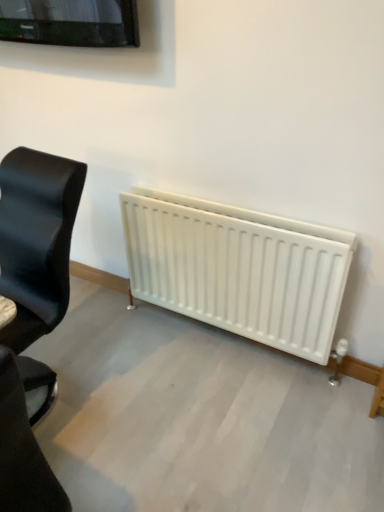
Find the location of a particular element. This screenshot has height=512, width=384. black leather chair at left, the 2th chair when ordered from front to back is located at coordinates (36, 240).

Measure the distance between point (72, 193) and camera.

The depth of point (72, 193) is 5.42 feet.

What do you see at coordinates (36, 240) in the screenshot? This screenshot has height=512, width=384. I see `black leather chair at left, the 2th chair when ordered from front to back` at bounding box center [36, 240].

This screenshot has height=512, width=384. What do you see at coordinates (23, 452) in the screenshot? I see `black leather chair at lower left, arranged as the second chair when viewed from the back` at bounding box center [23, 452].

Identify the location of black leather chair at lower left, arranged as the second chair when viewed from the back. (23, 452).

Where is `black leather chair at left, which is counted as the first chair, starting from the back`? black leather chair at left, which is counted as the first chair, starting from the back is located at coordinates (36, 240).

Is black leather chair at lower left, positioned as the first chair in front-to-back order, at the left side of black leather chair at left, the 2th chair when ordered from front to back?

Incorrect, black leather chair at lower left, positioned as the first chair in front-to-back order, is not on the left side of black leather chair at left, the 2th chair when ordered from front to back.

Consider the image. Is the position of black leather chair at lower left, positioned as the first chair in front-to-back order, more distant than that of black leather chair at left, the 2th chair when ordered from front to back?

No, the depth of black leather chair at lower left, positioned as the first chair in front-to-back order, is less than that of black leather chair at left, the 2th chair when ordered from front to back.

Is point (15, 474) in front of point (59, 209)?

That is True.

From the image's perspective, who appears lower, black leather chair at lower left, positioned as the first chair in front-to-back order, or black leather chair at left, which is counted as the first chair, starting from the back?

black leather chair at lower left, positioned as the first chair in front-to-back order, appears lower in the image.

Based on the photo, from a real-world perspective, who is located higher, black leather chair at lower left, positioned as the first chair in front-to-back order, or black leather chair at left, the 2th chair when ordered from front to back?

black leather chair at left, the 2th chair when ordered from front to back, from a real-world perspective.

Considering the relative sizes of black leather chair at lower left, arranged as the second chair when viewed from the back, and black leather chair at left, which is counted as the first chair, starting from the back, in the image provided, is black leather chair at lower left, arranged as the second chair when viewed from the back, wider than black leather chair at left, which is counted as the first chair, starting from the back,?

Yes.

Between black leather chair at lower left, positioned as the first chair in front-to-back order, and black leather chair at left, which is counted as the first chair, starting from the back, which one has less height?

With less height is black leather chair at left, which is counted as the first chair, starting from the back.

From the picture: In terms of size, does black leather chair at lower left, positioned as the first chair in front-to-back order, appear bigger or smaller than black leather chair at left, the 2th chair when ordered from front to back?

Clearly, black leather chair at lower left, positioned as the first chair in front-to-back order, is smaller in size than black leather chair at left, the 2th chair when ordered from front to back.

Is black leather chair at left, the 2th chair when ordered from front to back, a part of black leather chair at lower left, arranged as the second chair when viewed from the back?

No, black leather chair at left, the 2th chair when ordered from front to back, is not a part of black leather chair at lower left, arranged as the second chair when viewed from the back.

From the picture: Are black leather chair at lower left, arranged as the second chair when viewed from the back, and black leather chair at left, the 2th chair when ordered from front to back, beside each other?

No, black leather chair at lower left, arranged as the second chair when viewed from the back, is not next to black leather chair at left, the 2th chair when ordered from front to back.

Is black leather chair at lower left, arranged as the second chair when viewed from the back, facing towards black leather chair at left, the 2th chair when ordered from front to back?

No, black leather chair at lower left, arranged as the second chair when viewed from the back, does not turn towards black leather chair at left, the 2th chair when ordered from front to back.

What's the angular difference between black leather chair at lower left, positioned as the first chair in front-to-back order, and black leather chair at left, which is counted as the first chair, starting from the back,'s facing directions?

85.6 degrees separate the facing orientations of black leather chair at lower left, positioned as the first chair in front-to-back order, and black leather chair at left, which is counted as the first chair, starting from the back.

How far apart are black leather chair at lower left, positioned as the first chair in front-to-back order, and black leather chair at left, which is counted as the first chair, starting from the back?

A distance of 29.55 inches exists between black leather chair at lower left, positioned as the first chair in front-to-back order, and black leather chair at left, which is counted as the first chair, starting from the back.

Where is `chair behind the black leather chair at lower left, arranged as the second chair when viewed from the back`? This screenshot has width=384, height=512. chair behind the black leather chair at lower left, arranged as the second chair when viewed from the back is located at coordinates (36, 240).

Between black leather chair at left, the 2th chair when ordered from front to back, and black leather chair at lower left, positioned as the first chair in front-to-back order, which one appears on the right side from the viewer's perspective?

black leather chair at lower left, positioned as the first chair in front-to-back order.

Considering the positions of objects black leather chair at left, which is counted as the first chair, starting from the back, and black leather chair at lower left, positioned as the first chair in front-to-back order, in the image provided, who is behind, black leather chair at left, which is counted as the first chair, starting from the back, or black leather chair at lower left, positioned as the first chair in front-to-back order,?

black leather chair at left, which is counted as the first chair, starting from the back, is further away from the camera.

Which is closer to the camera, [13,346] or [17,474]?

The point [17,474] is more forward.

From the image's perspective, who appears lower, black leather chair at left, the 2th chair when ordered from front to back, or black leather chair at lower left, positioned as the first chair in front-to-back order?

From the image's view, black leather chair at lower left, positioned as the first chair in front-to-back order, is below.

From a real-world perspective, is black leather chair at left, which is counted as the first chair, starting from the back, positioned under black leather chair at lower left, positioned as the first chair in front-to-back order, based on gravity?

No.

Considering the relative sizes of black leather chair at left, the 2th chair when ordered from front to back, and black leather chair at lower left, arranged as the second chair when viewed from the back, in the image provided, is black leather chair at left, the 2th chair when ordered from front to back, wider than black leather chair at lower left, arranged as the second chair when viewed from the back,?

In fact, black leather chair at left, the 2th chair when ordered from front to back, might be narrower than black leather chair at lower left, arranged as the second chair when viewed from the back.

In the scene shown: Considering the sizes of objects black leather chair at left, which is counted as the first chair, starting from the back, and black leather chair at lower left, arranged as the second chair when viewed from the back, in the image provided, who is shorter, black leather chair at left, which is counted as the first chair, starting from the back, or black leather chair at lower left, arranged as the second chair when viewed from the back,?

With less height is black leather chair at left, which is counted as the first chair, starting from the back.

Who is bigger, black leather chair at left, the 2th chair when ordered from front to back, or black leather chair at lower left, positioned as the first chair in front-to-back order?

black leather chair at left, the 2th chair when ordered from front to back, is bigger.

Is black leather chair at left, the 2th chair when ordered from front to back, positioned beyond the bounds of black leather chair at lower left, positioned as the first chair in front-to-back order?

black leather chair at left, the 2th chair when ordered from front to back, is positioned outside black leather chair at lower left, positioned as the first chair in front-to-back order.

Are black leather chair at left, the 2th chair when ordered from front to back, and black leather chair at lower left, positioned as the first chair in front-to-back order, located far from each other?

No, black leather chair at left, the 2th chair when ordered from front to back, is not far away from black leather chair at lower left, positioned as the first chair in front-to-back order.

Does black leather chair at left, the 2th chair when ordered from front to back, turn towards black leather chair at lower left, positioned as the first chair in front-to-back order?

No, black leather chair at left, the 2th chair when ordered from front to back, is not facing towards black leather chair at lower left, positioned as the first chair in front-to-back order.

In the image, there is a black leather chair at left, the 2th chair when ordered from front to back. At what (x,y) coordinates should I click in order to perform the action: click on chair below it (from a real-world perspective). Please return your answer as a coordinate pair (x, y). The height and width of the screenshot is (512, 384). Looking at the image, I should click on tap(23, 452).

At what (x,y) coordinates should I click in order to perform the action: click on chair lying behind the black leather chair at lower left, positioned as the first chair in front-to-back order. Please return your answer as a coordinate pair (x, y). Looking at the image, I should click on (36, 240).

The width and height of the screenshot is (384, 512). In order to click on chair located on the left of black leather chair at lower left, arranged as the second chair when viewed from the back in this screenshot , I will do `click(36, 240)`.